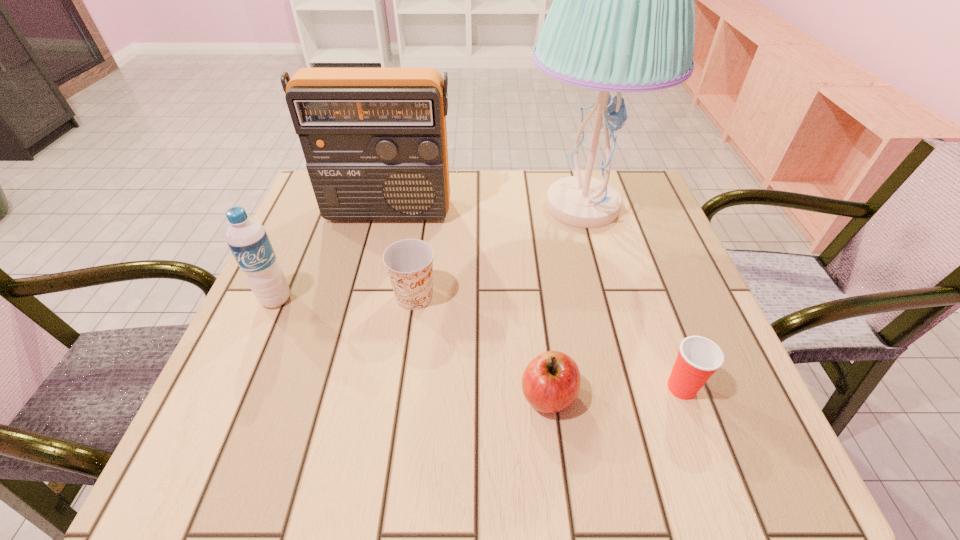
Locate an element on the screen. The height and width of the screenshot is (540, 960). object that is at the far right corner is located at coordinates (622, 19).

Image resolution: width=960 pixels, height=540 pixels. Identify the location of vacant area at the far edge. (430, 221).

Image resolution: width=960 pixels, height=540 pixels. What are the coordinates of `free space at the near edge of the desktop` in the screenshot? It's located at (464, 455).

Locate an element on the screen. This screenshot has height=540, width=960. vacant area at the left edge is located at coordinates (300, 354).

Identify the location of free space at the right edge of the desktop. The height and width of the screenshot is (540, 960). (643, 318).

Image resolution: width=960 pixels, height=540 pixels. Identify the location of free space at the far right corner of the desktop. (626, 171).

Where is `vacant space that is in between the right Dixie cup and the apple`? Image resolution: width=960 pixels, height=540 pixels. vacant space that is in between the right Dixie cup and the apple is located at coordinates (614, 392).

Locate an element on the screen. The width and height of the screenshot is (960, 540). vacant area that lies between the apple and the second tallest object is located at coordinates (468, 303).

The width and height of the screenshot is (960, 540). I want to click on empty space that is in between the nearer Dixie cup and the lamp, so click(632, 297).

At what (x,y) coordinates should I click in order to perform the action: click on empty space between the lamp and the radio receiver. Please return your answer as a coordinate pair (x, y). Looking at the image, I should click on (485, 208).